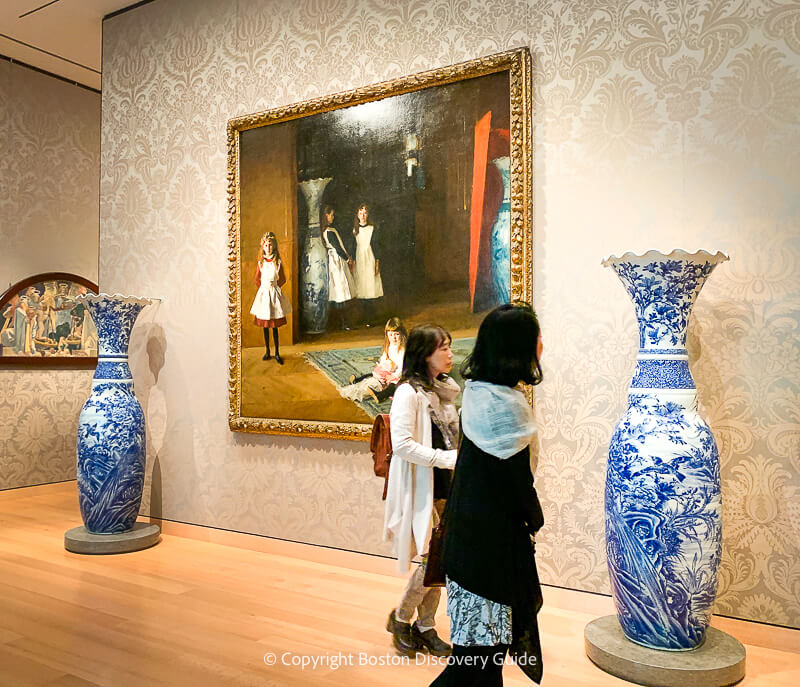
Find the location of a particular element. This screenshot has height=687, width=800. walls is located at coordinates (608, 194), (162, 225), (58, 213).